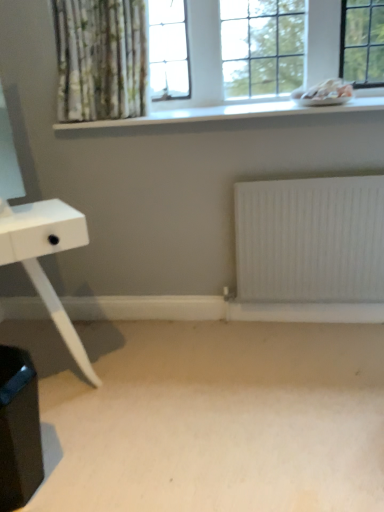
This screenshot has height=512, width=384. In order to click on vacant area situated to the left side of white matte radiator at lower center in this screenshot , I will do `click(228, 343)`.